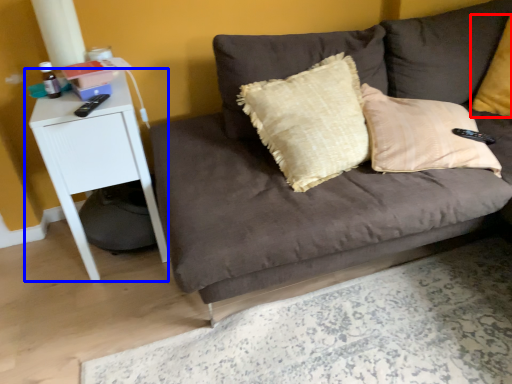
Question: Which point is further to the camera, pillow (highlighted by a red box) or table (highlighted by a blue box)?

Choices:
 (A) pillow
 (B) table

Answer: (A)